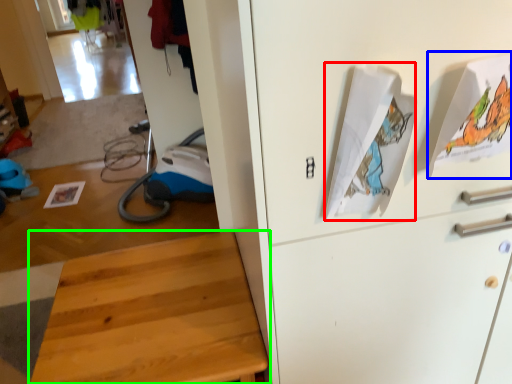
Question: Which object is the closest to the wrapping paper (highlighted by a red box)? Choose among these: wrapping paper (highlighted by a blue box) or furniture (highlighted by a green box).

Choices:
 (A) wrapping paper
 (B) furniture

Answer: (A)